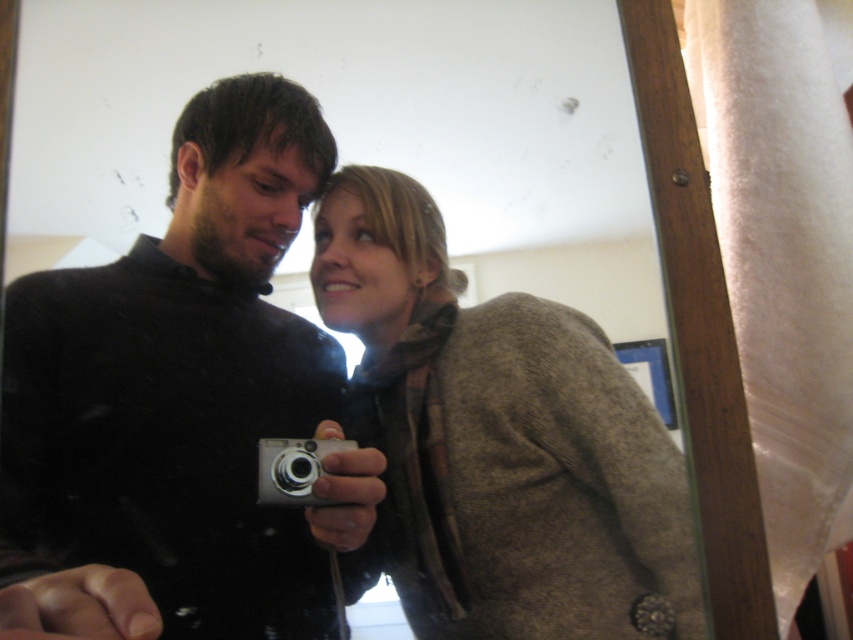
Question: Which object is the farthest from the matte black camera at center?

Choices:
 (A) silver metallic camera at center
 (B) brown woolen coat at center

Answer: (A)

Question: Among these objects, which one is farthest from the camera?

Choices:
 (A) matte black camera at center
 (B) brown woolen coat at center
 (C) silver metallic camera at center

Answer: (B)

Question: Is matte black camera at center thinner than brown woolen coat at center?

Choices:
 (A) no
 (B) yes

Answer: (A)

Question: Which object is the farthest from the matte black camera at center?

Choices:
 (A) silver metallic camera at center
 (B) brown woolen coat at center

Answer: (A)

Question: Does matte black camera at center have a greater width compared to silver metallic camera at center?

Choices:
 (A) no
 (B) yes

Answer: (B)

Question: In this image, where is matte black camera at center located relative to silver metallic camera at center?

Choices:
 (A) right
 (B) left

Answer: (B)